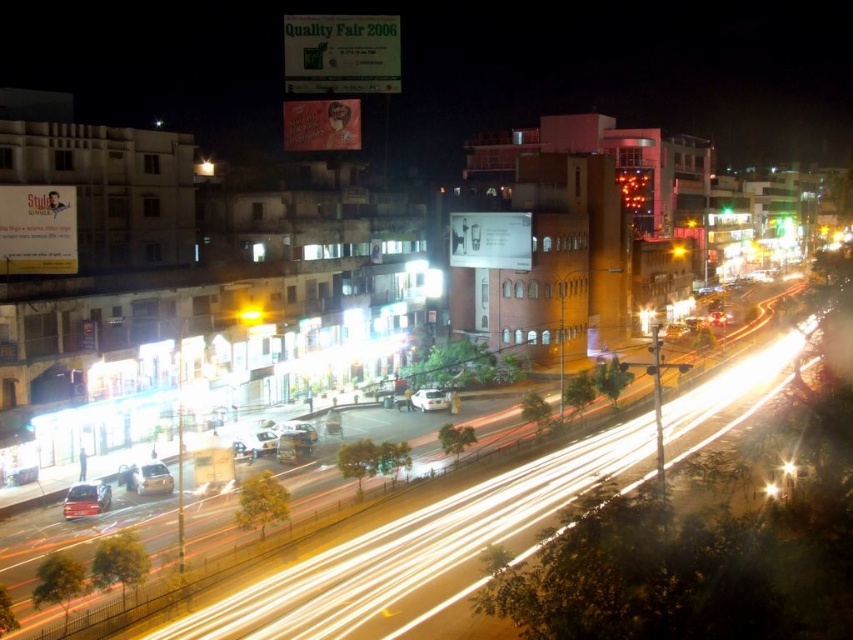
Which is behind, point (425, 390) or point (244, 317)?

Point (425, 390)

Who is more distant from viewer, (x=434, y=404) or (x=260, y=307)?

The point (x=434, y=404) is more distant.

The image size is (853, 640). Identify the location of white matte car at center. (430, 400).

Is point (163, 467) farther from viewer compared to point (444, 401)?

That is False.

Which of these two, gold metallic car at lower left or white matte car at center, stands shorter?

gold metallic car at lower left

Does point (131, 477) come behind point (428, 403)?

No.

You are a GUI agent. You are given a task and a screenshot of the screen. Output one action in this format:
    pyautogui.click(x=<x>, y=<y>)
    Task: Click on the gold metallic car at lower left
    
    Given the screenshot: What is the action you would take?
    pyautogui.click(x=149, y=477)

Can you confirm if metallic silver car at lower left is thinner than white matte car at center?

Yes.

Who is shorter, metallic silver car at lower left or white matte car at center?

metallic silver car at lower left is shorter.

Which is in front, point (102, 509) or point (437, 401)?

Point (102, 509) is more forward.

At what (x,y) coordinates should I click in order to perform the action: click on metallic silver car at lower left. Please return your answer as a coordinate pair (x, y). Looking at the image, I should click on [x=86, y=499].